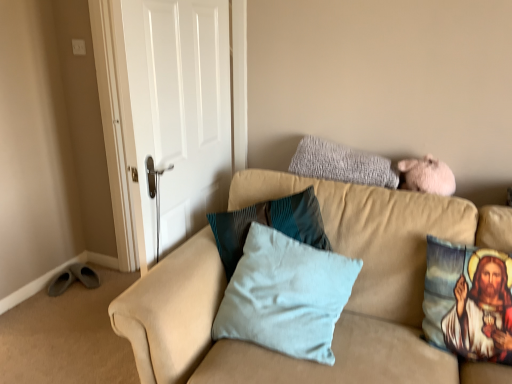
Question: From a real-world perspective, is white matte door at upper left positioned above or below printed fabric pillow with religious image at right, positioned as the 1th pillow in right-to-left order?

Choices:
 (A) below
 (B) above

Answer: (B)

Question: From the image's perspective, is white matte door at upper left above or below printed fabric pillow with religious image at right, the third pillow when ordered from left to right?

Choices:
 (A) below
 (B) above

Answer: (B)

Question: Considering the real-world distances, which object is closest to the white matte door at upper left?

Choices:
 (A) printed fabric pillow with religious image at right, positioned as the 1th pillow in right-to-left order
 (B) gray fluffy pillow at upper right, placed as the second pillow when sorted from left to right
 (C) beige fabric couch at upper right
 (D) light blue fabric pillow at center, the third pillow positioned from the right

Answer: (C)

Question: Which object is the farthest from the printed fabric pillow with religious image at right, positioned as the 1th pillow in right-to-left order?

Choices:
 (A) white matte door at upper left
 (B) light blue fabric pillow at center, positioned as the first pillow in left-to-right order
 (C) gray fluffy pillow at upper right, which is the second pillow in right-to-left order
 (D) beige fabric couch at upper right

Answer: (A)